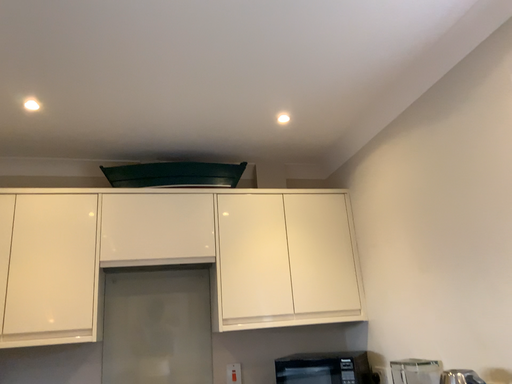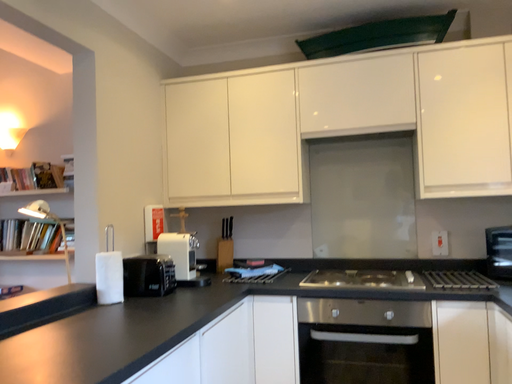
Question: How did the camera likely rotate when shooting the video?

Choices:
 (A) rotated right
 (B) rotated left

Answer: (B)